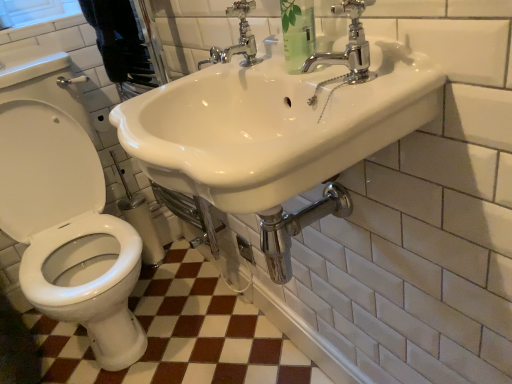
This screenshot has width=512, height=384. What do you see at coordinates (181, 334) in the screenshot? I see `white glossy ceramic tile at lower left` at bounding box center [181, 334].

The width and height of the screenshot is (512, 384). What do you see at coordinates (348, 46) in the screenshot?
I see `chrome/metallic faucet at upper right, which is the 2th tap from left to right` at bounding box center [348, 46].

Find the location of `chrome/metallic faucet at upper right, which ranks as the 2th tap in back-to-front order`. chrome/metallic faucet at upper right, which ranks as the 2th tap in back-to-front order is located at coordinates (348, 46).

Find the location of a particular element. white glossy toilet at left is located at coordinates (64, 208).

The width and height of the screenshot is (512, 384). Describe the element at coordinates (239, 39) in the screenshot. I see `chrome/metallic faucet at upper center, positioned as the second tap in front-to-back order` at that location.

You are a GUI agent. You are given a task and a screenshot of the screen. Output one action in this format:
    pyautogui.click(x=<x>, y=<y>)
    Task: Click on the clear plastic bottle at upper center
    Image resolution: width=512 pixels, height=384 pixels.
    Given the screenshot: What is the action you would take?
    pyautogui.click(x=297, y=33)

The image size is (512, 384). I want to click on white glossy ceramic tile at lower left, so click(x=181, y=334).

Is chrome/metallic faucet at upper center, arranged as the first tap when viewed from the left, oriented towards clear plastic bottle at upper center?

No, chrome/metallic faucet at upper center, arranged as the first tap when viewed from the left, is not oriented towards clear plastic bottle at upper center.

Is chrome/metallic faucet at upper center, positioned as the second tap in right-to-left order, in front of or behind clear plastic bottle at upper center in the image?

chrome/metallic faucet at upper center, positioned as the second tap in right-to-left order, is behind clear plastic bottle at upper center.

Who is smaller, chrome/metallic faucet at upper center, arranged as the first tap when viewed from the left, or clear plastic bottle at upper center?

chrome/metallic faucet at upper center, arranged as the first tap when viewed from the left.

Could you tell me if white glossy toilet at left is facing white glossy ceramic tile at lower left?

No, white glossy toilet at left is not facing towards white glossy ceramic tile at lower left.

Is white glossy toilet at left outside of white glossy ceramic tile at lower left?

Yes, white glossy toilet at left is located beyond the bounds of white glossy ceramic tile at lower left.

Are white glossy toilet at left and white glossy ceramic tile at lower left far apart?

No, there isn't a large distance between white glossy toilet at left and white glossy ceramic tile at lower left.

Is white glossy toilet at left in front of or behind white glossy ceramic tile at lower left in the image?

white glossy toilet at left is positioned closer to the viewer than white glossy ceramic tile at lower left.

Which is closer to the camera, (305, 16) or (137, 342)?

Clearly, point (305, 16) is closer to the camera than point (137, 342).

Would you say clear plastic bottle at upper center is a long distance from white glossy toilet at left?

No.

You are a GUI agent. You are given a task and a screenshot of the screen. Output one action in this format:
    pyautogui.click(x=<x>, y=<y>)
    Task: Click on the toiletry located above the white glossy toilet at left (from a real-world perspective)
    
    Given the screenshot: What is the action you would take?
    pyautogui.click(x=297, y=33)

Based on the photo, is chrome/metallic faucet at upper center, which is the 1th tap from back to front, facing towards white glossy sink at upper center?

No, chrome/metallic faucet at upper center, which is the 1th tap from back to front, is not turned towards white glossy sink at upper center.

From a real-world perspective, is chrome/metallic faucet at upper center, positioned as the second tap in front-to-back order, positioned under white glossy sink at upper center based on gravity?

No, from a real-world perspective, chrome/metallic faucet at upper center, positioned as the second tap in front-to-back order, is not beneath white glossy sink at upper center.

Which of these two, chrome/metallic faucet at upper center, positioned as the second tap in front-to-back order, or white glossy sink at upper center, is thinner?

chrome/metallic faucet at upper center, positioned as the second tap in front-to-back order, is thinner.

Considering the sizes of objects white glossy ceramic tile at lower left and white glossy toilet at left in the image provided, who is thinner, white glossy ceramic tile at lower left or white glossy toilet at left?

white glossy toilet at left.

From the image's perspective, does white glossy ceramic tile at lower left appear lower than white glossy toilet at left?

Yes.

Is white glossy ceramic tile at lower left facing away from white glossy toilet at left?

No, white glossy ceramic tile at lower left is not facing away from white glossy toilet at left.

Can you confirm if white glossy ceramic tile at lower left is taller than white glossy toilet at left?

No, white glossy ceramic tile at lower left is not taller than white glossy toilet at left.

Considering the points (291, 3) and (420, 101), which point is in front, point (291, 3) or point (420, 101)?

The point (420, 101) is closer.

Locate an element on the screen. Image resolution: width=512 pixels, height=384 pixels. toiletry above the white glossy sink at upper center (from the image's perspective) is located at coordinates (297, 33).

Which is more to the right, clear plastic bottle at upper center or white glossy sink at upper center?

Positioned to the right is clear plastic bottle at upper center.

Is clear plastic bottle at upper center closer to camera compared to white glossy sink at upper center?

That is False.

Is white glossy sink at upper center positioned with its back to chrome/metallic faucet at upper right, which ranks as the 2th tap in back-to-front order?

That's not correct — white glossy sink at upper center is not looking away from chrome/metallic faucet at upper right, which ranks as the 2th tap in back-to-front order.

Identify the location of sink that appears below the chrome/metallic faucet at upper right, acting as the first tap starting from the front (from the image's perspective). (277, 118).

In the scene shown: Does white glossy sink at upper center lie behind chrome/metallic faucet at upper right, which ranks as the 1th tap in right-to-left order?

No, white glossy sink at upper center is closer to the viewer.

Based on their sizes in the image, would you say white glossy sink at upper center is bigger or smaller than chrome/metallic faucet at upper right, acting as the first tap starting from the front?

white glossy sink at upper center is bigger than chrome/metallic faucet at upper right, acting as the first tap starting from the front.

Find the location of a particular element. tap behind the clear plastic bottle at upper center is located at coordinates (239, 39).

Image resolution: width=512 pixels, height=384 pixels. In order to click on sit in front of the white glossy ceramic tile at lower left in this screenshot , I will do `click(64, 208)`.

Looking at this image, based on their spatial positions, is chrome/metallic faucet at upper center, positioned as the second tap in right-to-left order, or white glossy toilet at left closer to white glossy sink at upper center?

chrome/metallic faucet at upper center, positioned as the second tap in right-to-left order, lies closer to white glossy sink at upper center than the other object.

From the image, which object appears to be farther from white glossy ceramic tile at lower left, chrome/metallic faucet at upper center, arranged as the first tap when viewed from the left, or chrome/metallic faucet at upper right, acting as the first tap starting from the front?

Based on the image, chrome/metallic faucet at upper right, acting as the first tap starting from the front, appears to be further to white glossy ceramic tile at lower left.

Which object lies nearer to the anchor point white glossy sink at upper center, chrome/metallic faucet at upper center, positioned as the second tap in right-to-left order, or clear plastic bottle at upper center?

clear plastic bottle at upper center is closer to white glossy sink at upper center.

In the scene shown: Based on their spatial positions, is white glossy sink at upper center or clear plastic bottle at upper center further from white glossy toilet at left?

clear plastic bottle at upper center is positioned further to the anchor white glossy toilet at left.

Looking at the image, which one is located further to white glossy sink at upper center, chrome/metallic faucet at upper right, which ranks as the 1th tap in right-to-left order, or white glossy toilet at left?

white glossy toilet at left.

From the image, which object appears to be farther from chrome/metallic faucet at upper center, which is the 1th tap from back to front, clear plastic bottle at upper center or white glossy ceramic tile at lower left?

Based on the image, white glossy ceramic tile at lower left appears to be further to chrome/metallic faucet at upper center, which is the 1th tap from back to front.

Considering their positions, is white glossy ceramic tile at lower left positioned further to white glossy toilet at left than white glossy sink at upper center?

The object further to white glossy toilet at left is white glossy sink at upper center.

From the image, which object appears to be farther from chrome/metallic faucet at upper center, positioned as the second tap in right-to-left order, white glossy ceramic tile at lower left or chrome/metallic faucet at upper right, which ranks as the 1th tap in right-to-left order?

white glossy ceramic tile at lower left is further to chrome/metallic faucet at upper center, positioned as the second tap in right-to-left order.

I want to click on sink between white glossy toilet at left and chrome/metallic faucet at upper right, which ranks as the 2th tap in back-to-front order, from left to right, so click(x=277, y=118).

Identify the location of sit between clear plastic bottle at upper center and white glossy ceramic tile at lower left from top to bottom. The width and height of the screenshot is (512, 384). (64, 208).

Locate an element on the screen. The image size is (512, 384). tap between white glossy sink at upper center and chrome/metallic faucet at upper center, positioned as the second tap in front-to-back order, in the front-back direction is located at coordinates (348, 46).

Find the location of `tap between white glossy toilet at left and chrome/metallic faucet at upper right, which ranks as the 1th tap in right-to-left order, from left to right`. tap between white glossy toilet at left and chrome/metallic faucet at upper right, which ranks as the 1th tap in right-to-left order, from left to right is located at coordinates (239, 39).